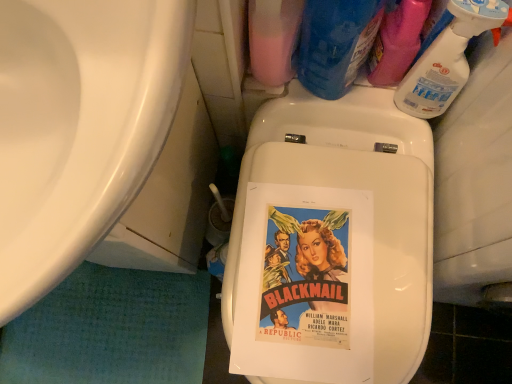
Question: In the image, is blue plastic bottle at upper right, which is the 3th cleaning product from right to left, on the left side or the right side of white glossy sink at left?

Choices:
 (A) left
 (B) right

Answer: (B)

Question: From the image's perspective, is blue plastic bottle at upper right, which is the 3th cleaning product from right to left, located above or below white glossy sink at left?

Choices:
 (A) below
 (B) above

Answer: (B)

Question: Which is nearer to the pink matte bottle at upper center, the 1th cleaning product positioned from the left?

Choices:
 (A) clear plastic spray bottle at upper right, acting as the 3th cleaning product starting from the left
 (B) clear plastic spray bottle at upper right, the 4th cleaning product when ordered from left to right
 (C) white glossy sink at left
 (D) blue plastic bottle at upper right, which is the 3th cleaning product from right to left

Answer: (D)

Question: Estimate the real-world distances between objects in this image. Which object is closer to the white glossy sink at left?

Choices:
 (A) clear plastic spray bottle at upper right, positioned as the 1th cleaning product in right-to-left order
 (B) pink matte bottle at upper center, the 1th cleaning product positioned from the left
 (C) clear plastic spray bottle at upper right, acting as the 3th cleaning product starting from the left
 (D) blue plastic bottle at upper right, the second cleaning product viewed from the left

Answer: (B)